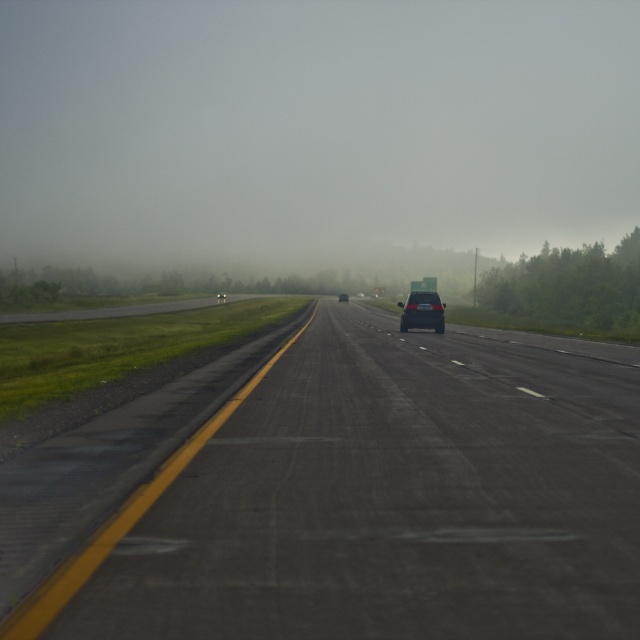
You are a drone operator trying to land a drone on the black asphalt runway at center. However, there is a satin black suv at center currently parked there. Can the drone safely land on the runway without hitting the suv?

The black asphalt runway at center is positioned under the satin black suv at center, so the drone cannot safely land there as the suv is directly above the runway.

You are a drone operator trying to fly a drone over the black asphalt runway at center and the satin black suv at center. Considering their heights, which object will the drone need to ascend higher to pass over?

The drone will need to ascend higher to pass over the satin black suv at center because it has a greater height than the black asphalt runway at center.

You are a drone operator trying to land a drone on the black asphalt runway at center. The drone has a GPS coordinate of point (385, 499). Is this point on the runway?

Yes, the point (385, 499) corresponds to the black asphalt runway at center, so the drone can land there.